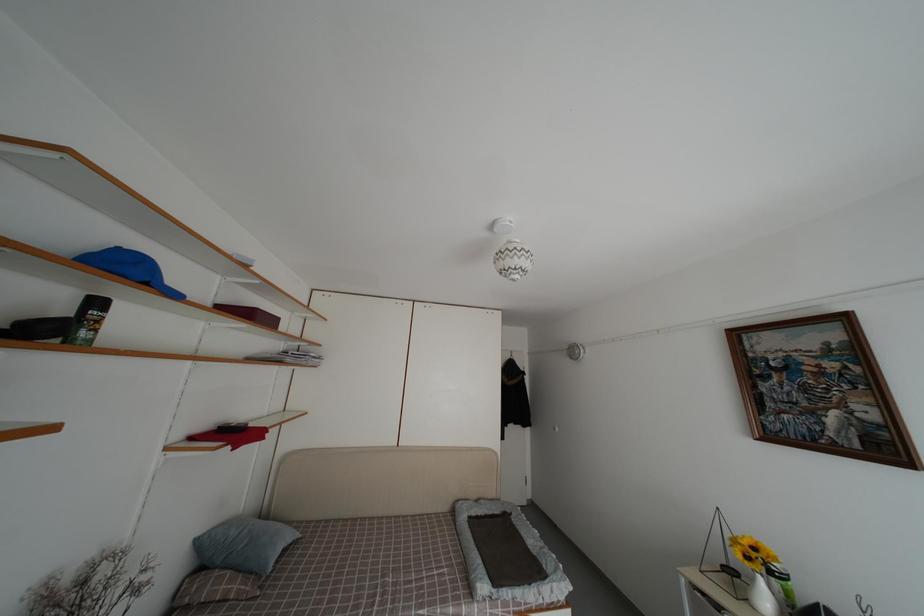
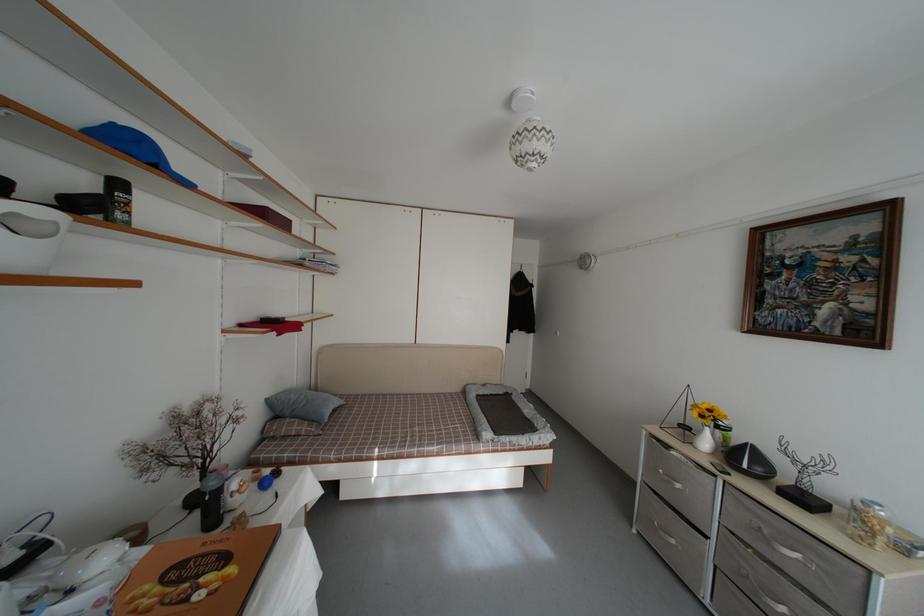
Locate, in the second image, the point that corresponds to (x=274, y=584) in the first image.

(332, 431)